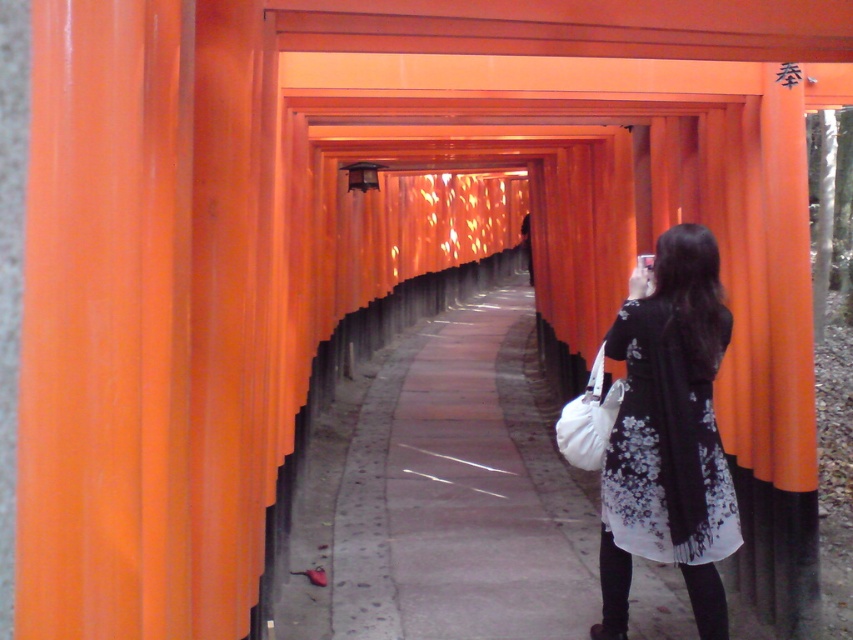
You are wearing a black floral dress at center and want to walk towards the exit of the torii gate tunnel. Considering the distance between you and the camera is 3.90 meters, how many steps would you need to take to reach the exit if each step covers 0.75 meters?

The distance between the black floral dress at center and the camera is 3.90 meters. If each step covers 0.75 meters, dividing 3.90 by 0.75 gives approximately 5.2 steps. Since you can take half steps, you would need about 5 steps to reach the exit.